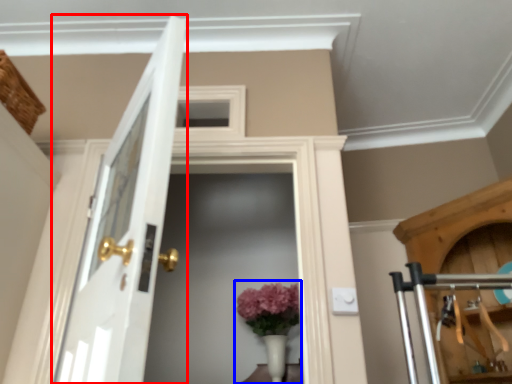
Question: Which object appears closest to the camera in this image, door (highlighted by a red box) or floral arrangement (highlighted by a blue box)?

Choices:
 (A) door
 (B) floral arrangement

Answer: (A)